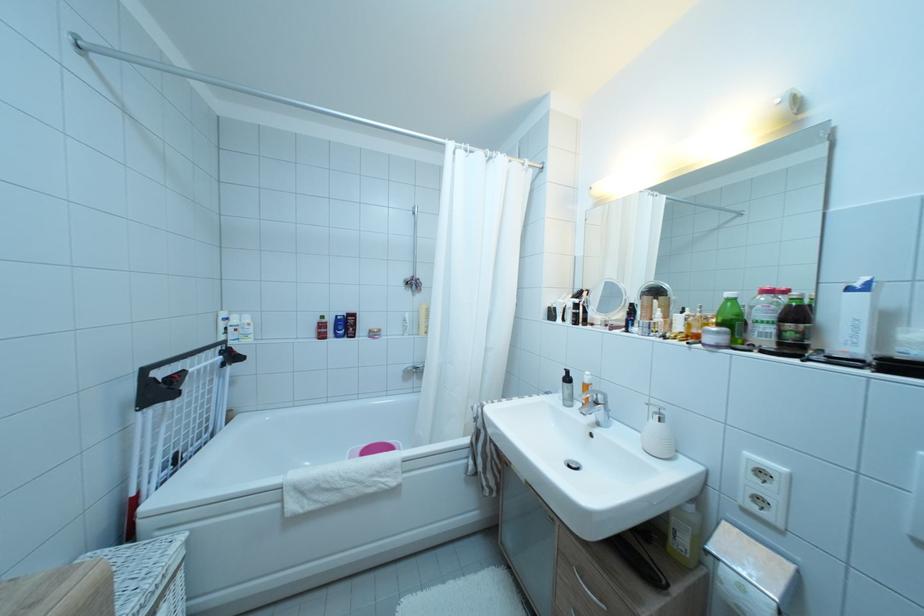
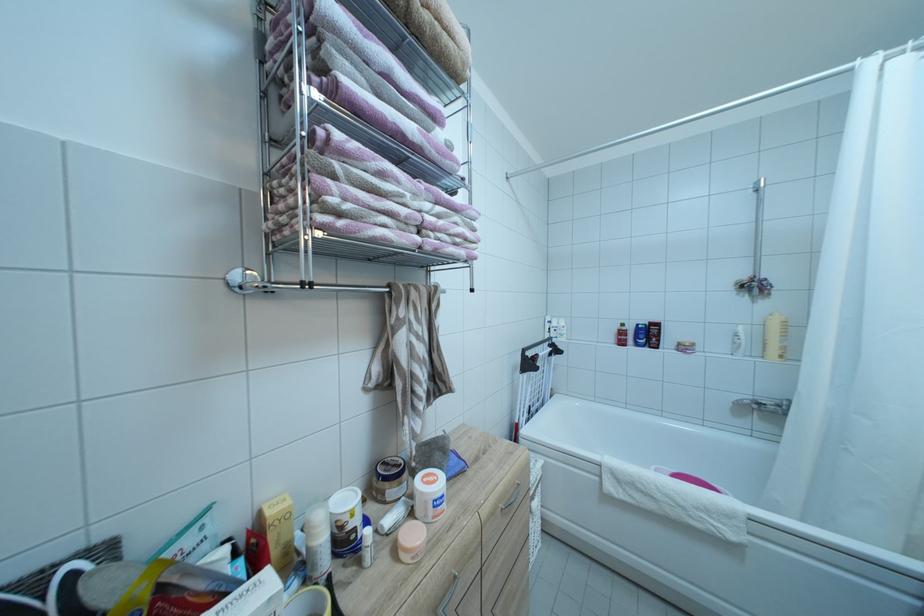
The point at (430, 334) is marked in the first image. Where is the corresponding point in the second image?

(781, 357)